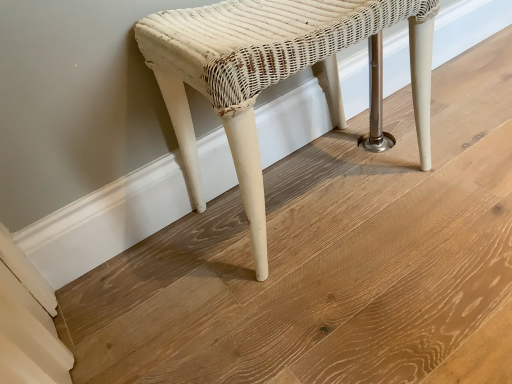
Locate an element on the screen. The width and height of the screenshot is (512, 384). vacant space in white wicker stool at center (from a real-world perspective) is located at coordinates click(313, 192).